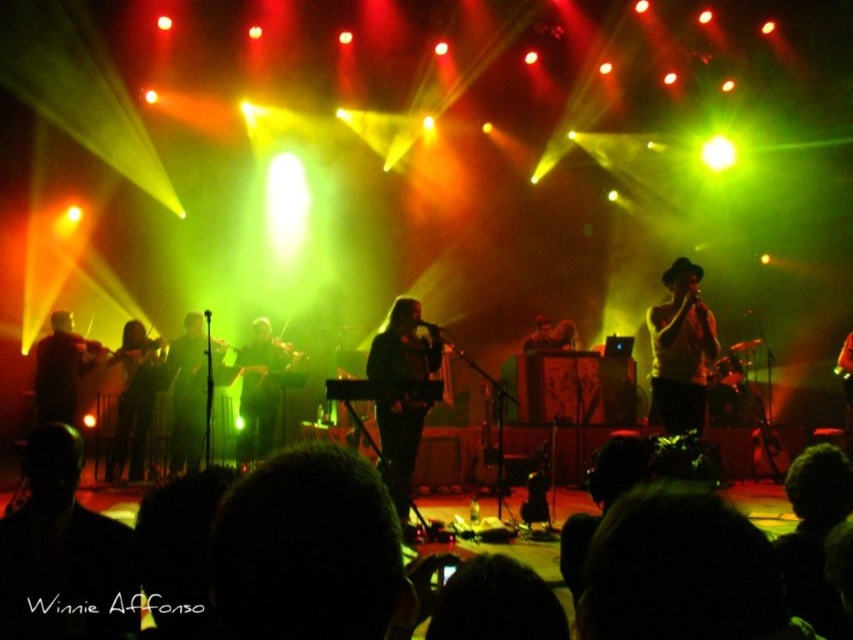
Who is taller, matte black guitar at center or matte black guitar at left?

matte black guitar at center

Which is more to the left, matte black guitar at center or matte black guitar at left?

From the viewer's perspective, matte black guitar at left appears more on the left side.

This screenshot has height=640, width=853. I want to click on matte black guitar at center, so click(190, 392).

Which is below, black fabric guitar at left or dark brown violin at center?

black fabric guitar at left is below.

Which is more to the left, black fabric guitar at left or dark brown violin at center?

Positioned to the left is black fabric guitar at left.

Is point (128, 436) closer to viewer compared to point (260, 332)?

That is True.

The image size is (853, 640). In order to click on black fabric guitar at left in this screenshot , I will do `click(132, 400)`.

Is matte black guitar at center below black fabric guitar at left?

Actually, matte black guitar at center is above black fabric guitar at left.

Locate an element on the screen. matte black guitar at center is located at coordinates (190, 392).